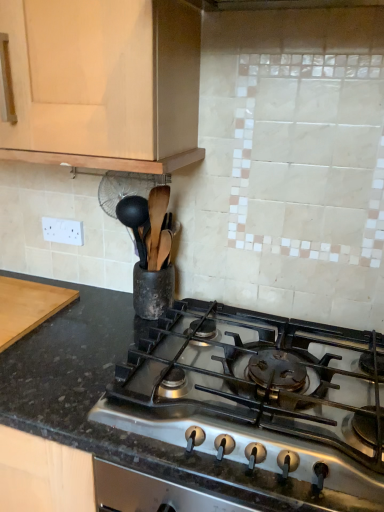
The width and height of the screenshot is (384, 512). Identify the location of vacant area situated below matte wood cabinet at upper left (from a real-world perspective). (89, 317).